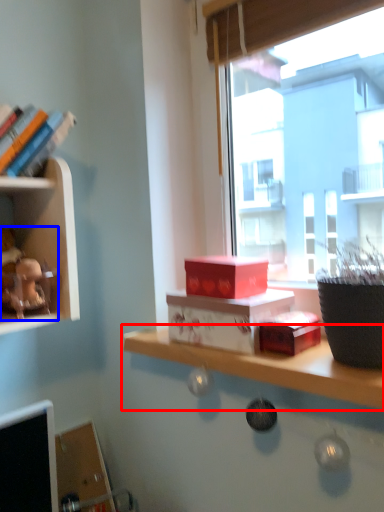
Question: Which object appears farthest to the camera in this image, shelf (highlighted by a red box) or toy (highlighted by a blue box)?

Choices:
 (A) shelf
 (B) toy

Answer: (B)